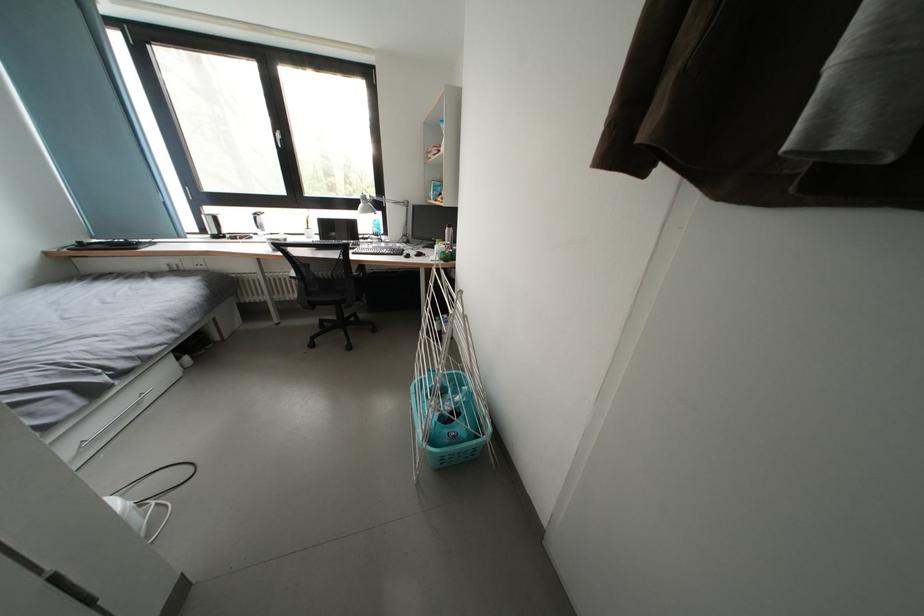
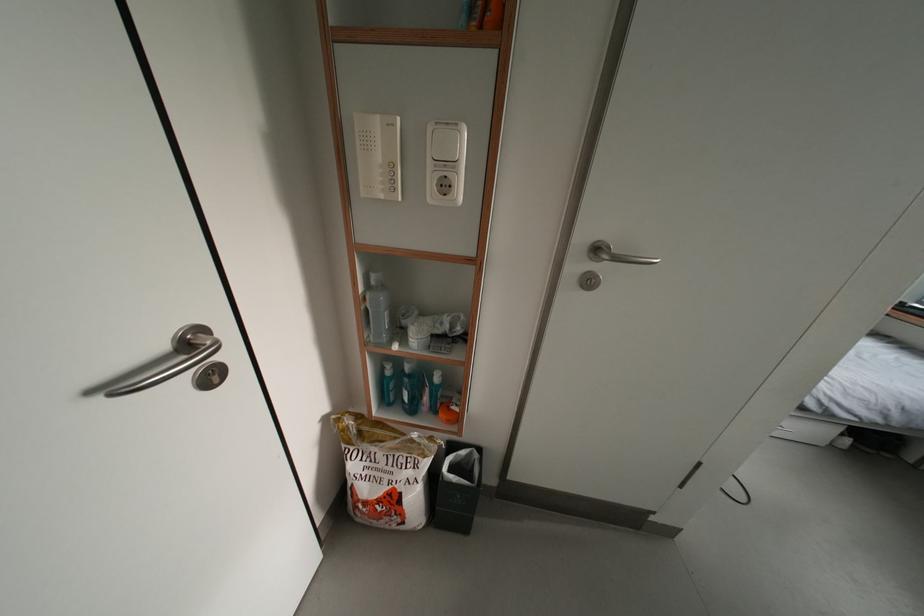
The first image is from the beginning of the video and the second image is from the end. How did the camera likely rotate when shooting the video?

The camera's rotation is toward left-down.